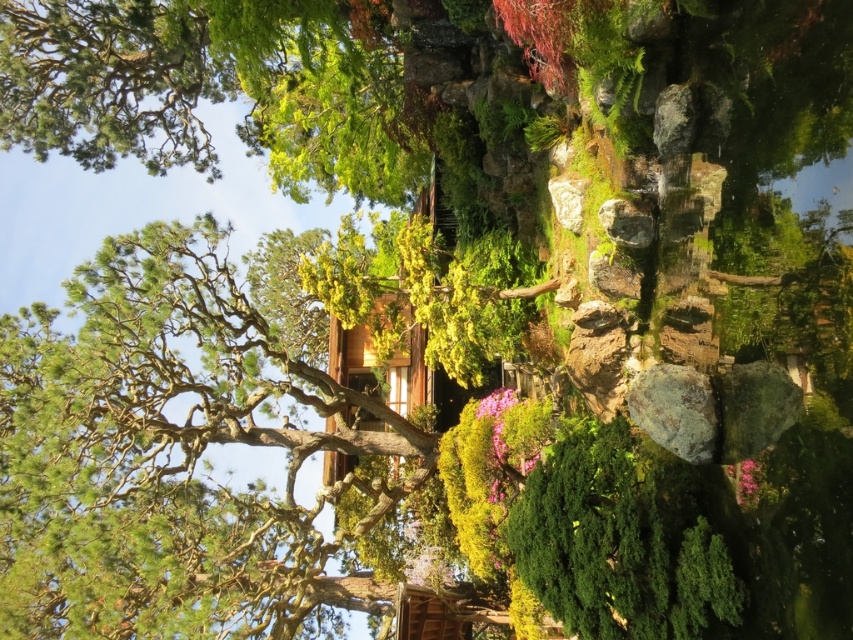
Question: Can you confirm if green textured tree at center is positioned below gray rough rock at center-right?

Choices:
 (A) no
 (B) yes

Answer: (B)

Question: Among these points, which one is farthest from the camera?

Choices:
 (A) (432, 554)
 (B) (711, 429)

Answer: (A)

Question: Is green textured tree at center positioned before pink matte flower at center?

Choices:
 (A) no
 (B) yes

Answer: (B)

Question: Where is green textured tree at center located in relation to gray rough rock at center-right in the image?

Choices:
 (A) above
 (B) below

Answer: (B)

Question: Estimate the real-world distances between objects in this image. Which object is farther from the gray rough rock at center-right?

Choices:
 (A) pink matte flower at center
 (B) green textured tree at center

Answer: (B)

Question: Which of the following is the farthest from the observer?

Choices:
 (A) pink matte flower at center
 (B) gray rough rock at center-right

Answer: (A)